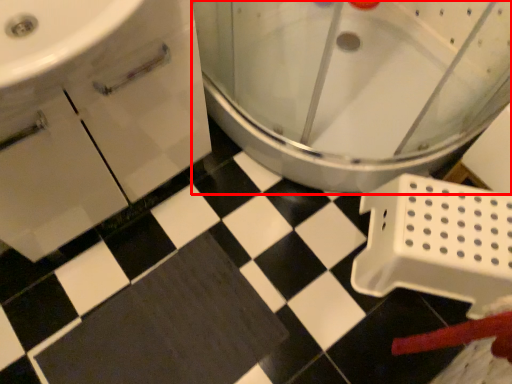
Question: Observing the image, what is the correct spatial positioning of toilet (annotated by the red box) in reference to bath mat?

Choices:
 (A) left
 (B) right

Answer: (B)